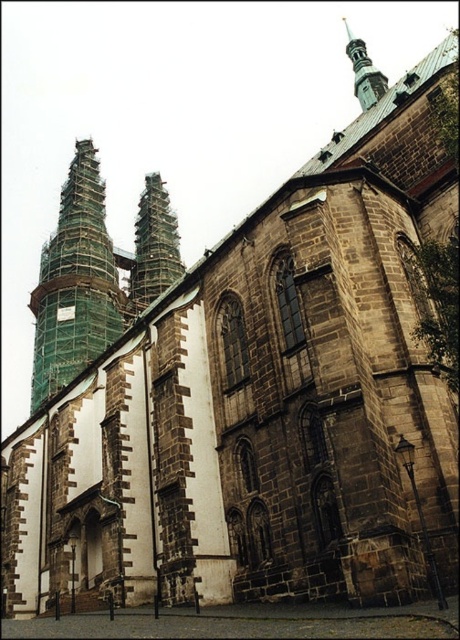
You are an architect inspecting the church. You notice the green scaffolding tower at left and the shiny silver spire at upper center. Which structure is smaller in size?

The green scaffolding tower at left is smaller in size compared to the shiny silver spire at upper center.

You are an architect inspecting the church. You notice the green scaffolding tower at upper left and the shiny silver spire at upper center. Which one has a greater width?

The shiny silver spire at upper center has a greater width than the green scaffolding tower at upper left.